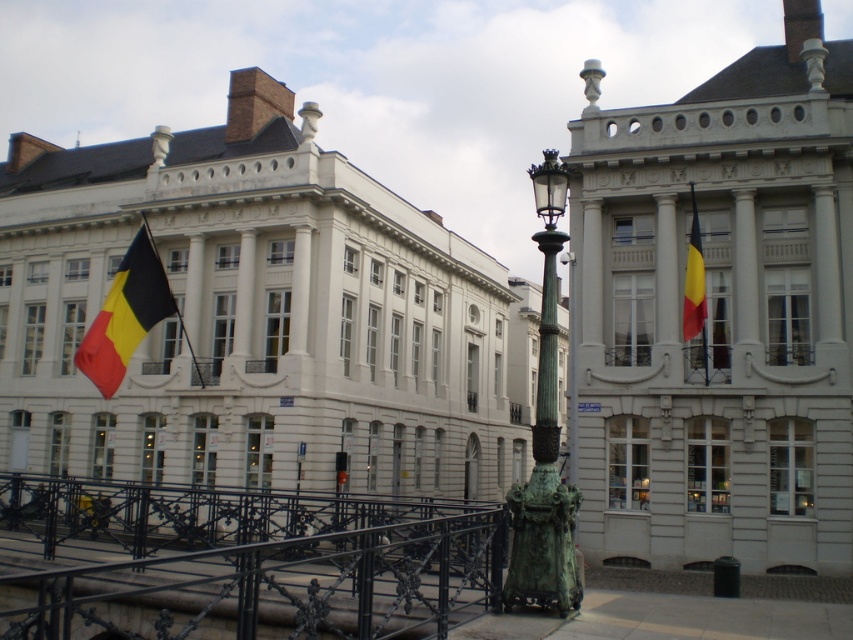
Question: Does white stone building at center appear on the right side of bronze/green patina streetlight at center?

Choices:
 (A) yes
 (B) no

Answer: (B)

Question: Can you confirm if matte white building at center is positioned below yellow-red striped fabric flag at upper right?

Choices:
 (A) no
 (B) yes

Answer: (A)

Question: Is black wrought iron railing at lower left positioned in front of bronze statue at center?

Choices:
 (A) no
 (B) yes

Answer: (B)

Question: Which object is the closest to the yellow-red striped fabric flag at upper right?

Choices:
 (A) polished metal flag pole at center
 (B) bronze/green patina streetlight at center

Answer: (B)

Question: Which object is the farthest from the white stone building at center?

Choices:
 (A) bronze statue at center
 (B) black wrought iron railing at lower left
 (C) matte white building at center

Answer: (A)

Question: Among these objects, which one is nearest to the camera?

Choices:
 (A) matte fabric flag at left
 (B) yellow-red striped fabric flag at upper right
 (C) white stone building at center

Answer: (B)